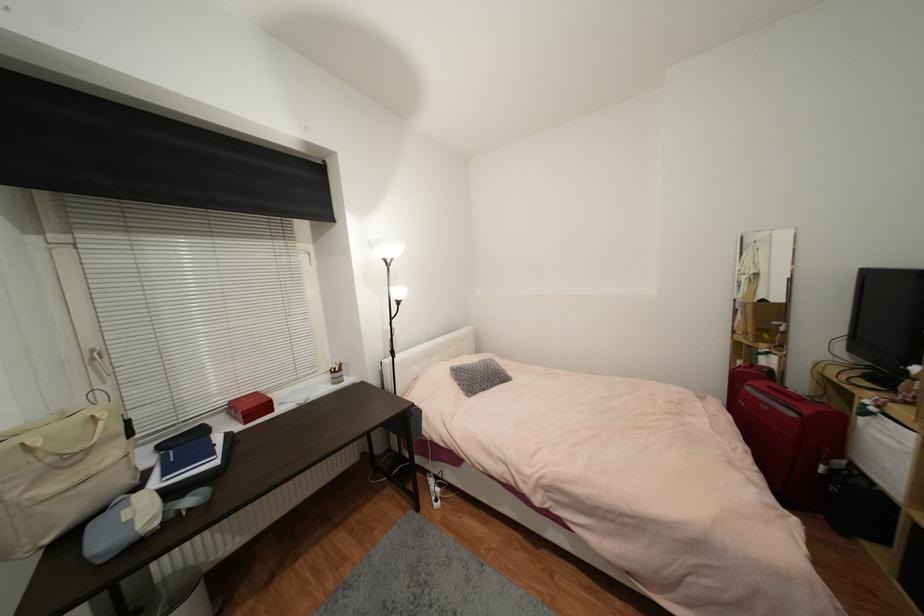
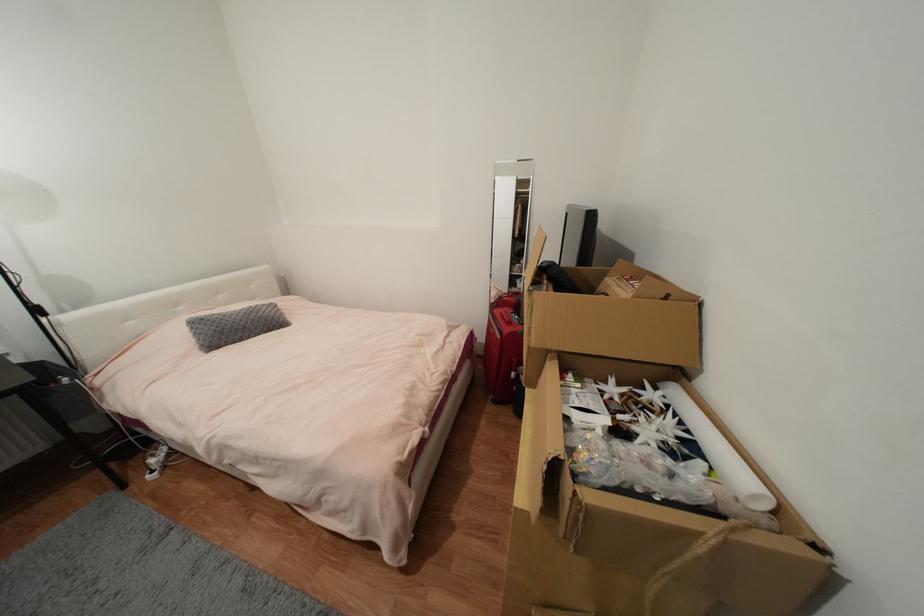
The point at (487, 371) is marked in the first image. Where is the corresponding point in the second image?

(244, 320)